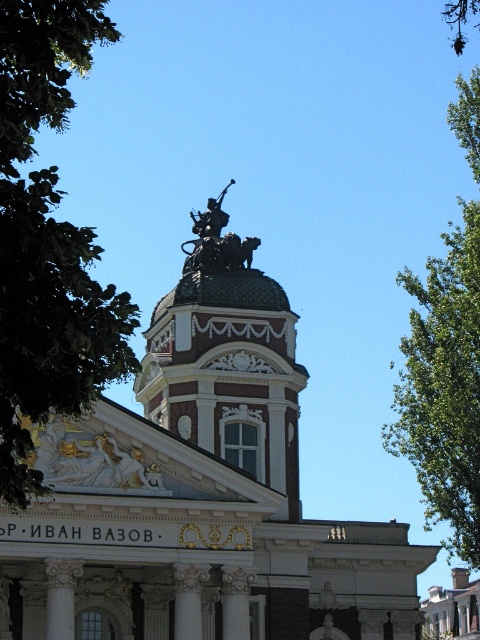
Question: Based on their relative distances, which object is farther from the polished bronze statue at center?

Choices:
 (A) bronze statue at center
 (B) green leafy tree at upper left
 (C) green leafy tree at upper right

Answer: (B)

Question: Which of these objects is positioned closest to the polished bronze statue at upper center?

Choices:
 (A) bronze statue at center
 (B) green leafy tree at upper right
 (C) green leafy tree at upper left
 (D) polished bronze statue at center

Answer: (D)

Question: Observing the image, what is the correct spatial positioning of polished bronze statue at center in reference to green leafy tree at upper right?

Choices:
 (A) right
 (B) left

Answer: (B)

Question: Does green leafy tree at upper left appear on the left side of polished bronze statue at center?

Choices:
 (A) yes
 (B) no

Answer: (A)

Question: Is green leafy tree at upper left bigger than bronze statue at center?

Choices:
 (A) no
 (B) yes

Answer: (B)

Question: Which point is farther from the camera taking this photo?

Choices:
 (A) (157, 564)
 (B) (423, 474)
 (C) (294, 512)
 (D) (247, 264)

Answer: (D)